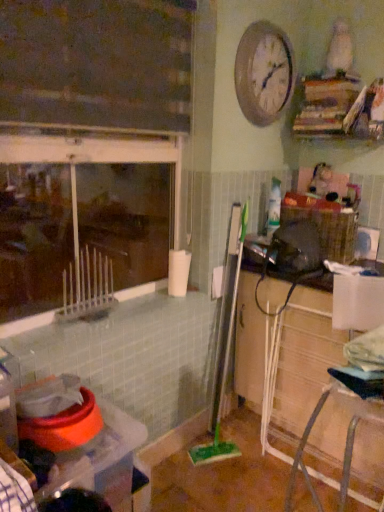
Question: Is metallic silver clock at upper center bigger than woven brown basket at right?

Choices:
 (A) no
 (B) yes

Answer: (A)

Question: Considering the relative sizes of metallic silver clock at upper center and woven brown basket at right in the image provided, is metallic silver clock at upper center shorter than woven brown basket at right?

Choices:
 (A) no
 (B) yes

Answer: (A)

Question: Considering the relative positions of metallic silver clock at upper center and woven brown basket at right in the image provided, is metallic silver clock at upper center in front of woven brown basket at right?

Choices:
 (A) yes
 (B) no

Answer: (A)

Question: Is metallic silver clock at upper center turned away from woven brown basket at right?

Choices:
 (A) yes
 (B) no

Answer: (B)

Question: From a real-world perspective, is metallic silver clock at upper center over woven brown basket at right?

Choices:
 (A) yes
 (B) no

Answer: (A)

Question: Is metallic silver clock at upper center touching woven brown basket at right?

Choices:
 (A) yes
 (B) no

Answer: (B)

Question: Would you say woven brown basket at right is outside plastic container at lower left?

Choices:
 (A) no
 (B) yes

Answer: (B)

Question: Is woven brown basket at right beside plastic container at lower left?

Choices:
 (A) yes
 (B) no

Answer: (B)

Question: Is plastic container at lower left surrounded by woven brown basket at right?

Choices:
 (A) no
 (B) yes

Answer: (A)

Question: From the image's perspective, is woven brown basket at right located above plastic container at lower left?

Choices:
 (A) yes
 (B) no

Answer: (A)

Question: From the image's perspective, would you say woven brown basket at right is shown under plastic container at lower left?

Choices:
 (A) no
 (B) yes

Answer: (A)

Question: Is the position of woven brown basket at right more distant than that of plastic container at lower left?

Choices:
 (A) yes
 (B) no

Answer: (A)

Question: From the image's perspective, is wooden cabinet at lower right on green plastic brush at center?

Choices:
 (A) no
 (B) yes

Answer: (A)